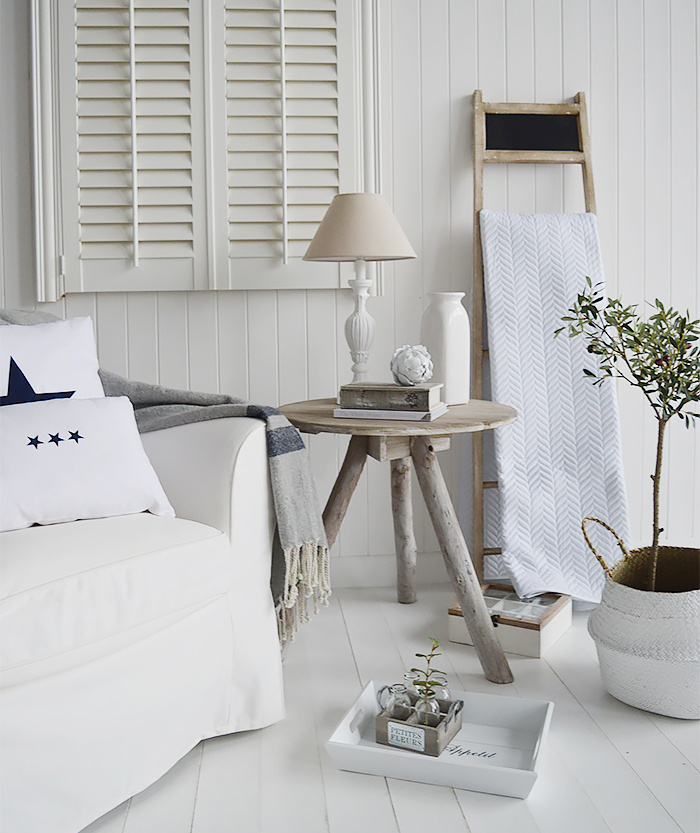
Locate an element on the screen. floor is located at coordinates (281, 796).